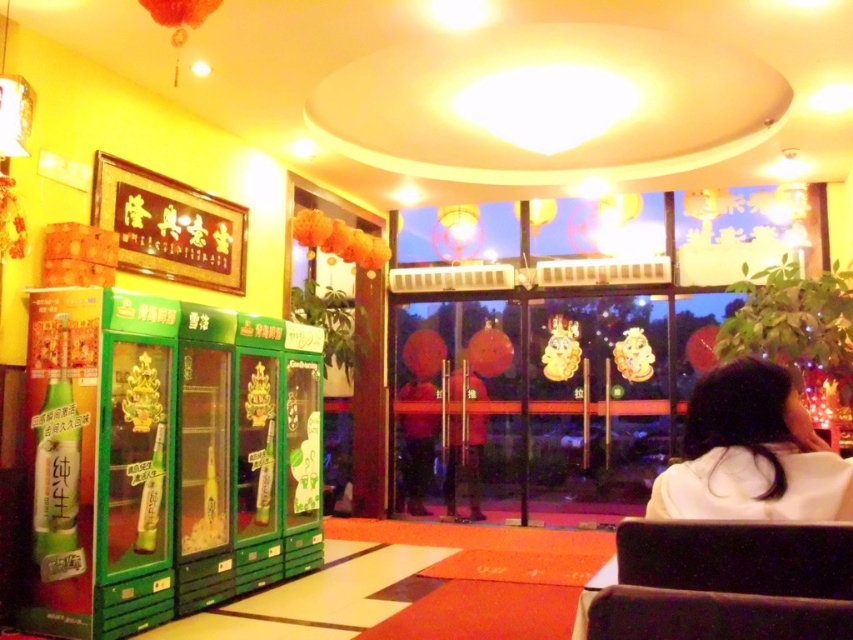
You are a guest entering the restaurant and see the velvet brown chair at lower right and the white matte hair at lower right. Which object is located to the left when facing the entrance?

The velvet brown chair at lower right is positioned on the left side of white matte hair at lower right, so when facing the entrance, the velvet brown chair at lower right is to the left of the white matte hair at lower right.

From the picture: You are a customer entering the restaurant and want to sit down. You see a velvet brown chair at lower right and a white matte hair at lower right. Which object is closer to you?

The velvet brown chair at lower right is closer to the viewer than the white matte hair at lower right.